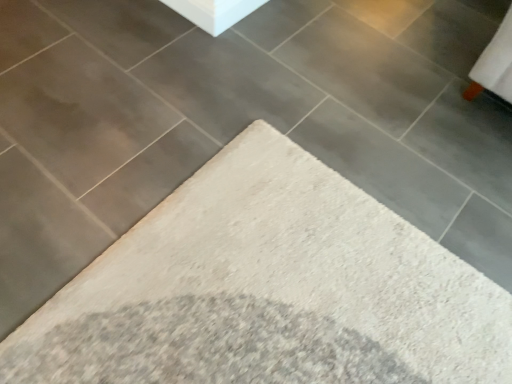
Question: In the image, is white shag rug at center positioned in front of or behind white smooth concrete at upper center?

Choices:
 (A) behind
 (B) front

Answer: (B)

Question: In the image, is white shag rug at center on the left side or the right side of white smooth concrete at upper center?

Choices:
 (A) right
 (B) left

Answer: (B)

Question: Is white shag rug at center inside or outside of white smooth concrete at upper center?

Choices:
 (A) outside
 (B) inside

Answer: (A)

Question: Is white smooth concrete at upper center inside the boundaries of white shag rug at center, or outside?

Choices:
 (A) inside
 (B) outside

Answer: (B)

Question: From a real-world perspective, is white smooth concrete at upper center positioned above or below white shag rug at center?

Choices:
 (A) below
 (B) above

Answer: (B)

Question: Is white smooth concrete at upper center taller or shorter than white shag rug at center?

Choices:
 (A) tall
 (B) short

Answer: (A)

Question: Does point (241, 8) appear closer or farther from the camera than point (146, 299)?

Choices:
 (A) closer
 (B) farther

Answer: (B)